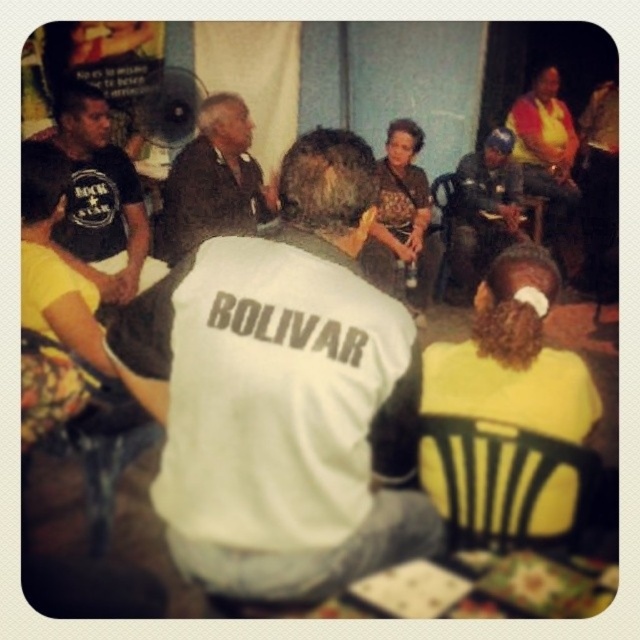
Question: Is black plastic chair at lower right further to the viewer compared to dark brown leather jacket at center?

Choices:
 (A) no
 (B) yes

Answer: (A)

Question: Which object is closer to the camera taking this photo?

Choices:
 (A) black t-shirt at left
 (B) white fabric shirt at center
 (C) black plastic chair at lower right
 (D) blue helmet at center

Answer: (B)

Question: Based on their relative distances, which object is nearer to the dark brown leather jacket at center?

Choices:
 (A) blue helmet at center
 (B) black t-shirt at left
 (C) black plastic chair at lower right
 (D) white fabric shirt at center

Answer: (B)

Question: Can you confirm if black t-shirt at left is wider than blue helmet at center?

Choices:
 (A) no
 (B) yes

Answer: (A)

Question: Does black t-shirt at left appear over blue helmet at center?

Choices:
 (A) yes
 (B) no

Answer: (B)

Question: Estimate the real-world distances between objects in this image. Which object is closer to the dark brown leather jacket at center?

Choices:
 (A) black plastic chair at lower right
 (B) white fabric shirt at center
 (C) blue helmet at center

Answer: (C)